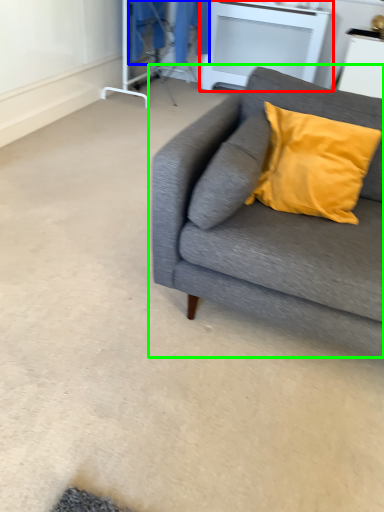
Question: Which object is positioned farthest from table (highlighted by a red box)? Select from laundry (highlighted by a blue box) and studio couch (highlighted by a green box).

Choices:
 (A) laundry
 (B) studio couch

Answer: (B)